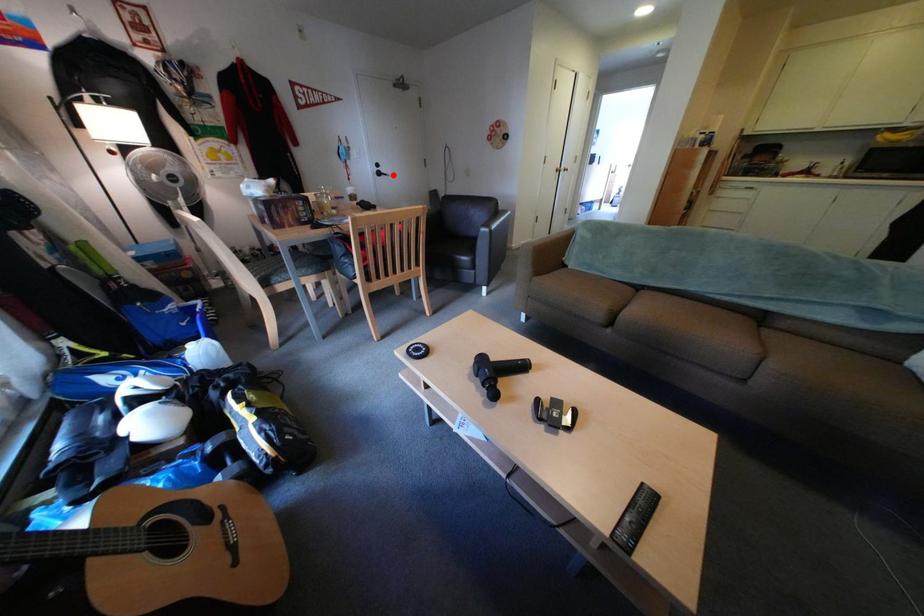
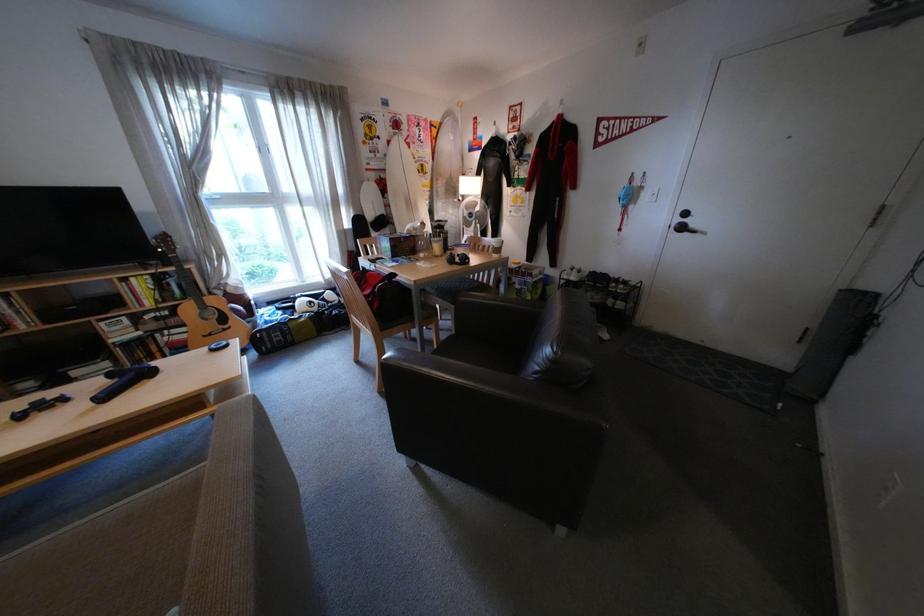
Locate, in the second image, the point that corresponds to the highlighted location in the first image.

(696, 229)